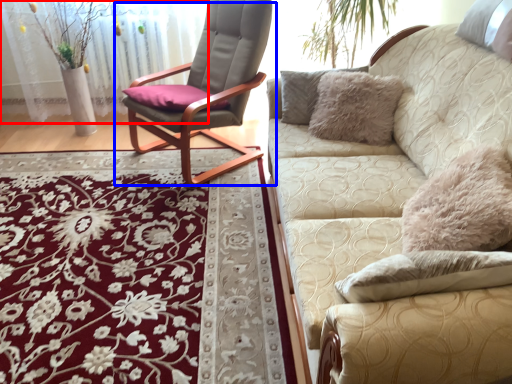
Question: Which point is closer to the camera, glass door (highlighted by a red box) or chair (highlighted by a blue box)?

Choices:
 (A) glass door
 (B) chair

Answer: (B)